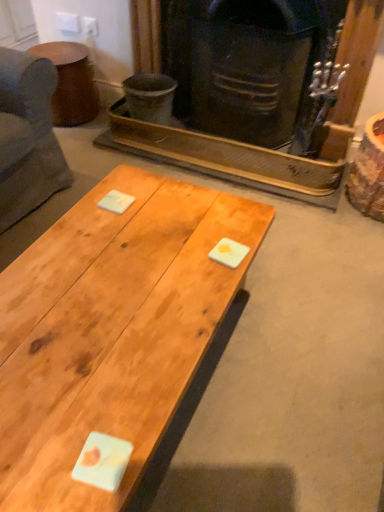
In order to face brown matte side table at upper left, should I rotate leftwards or rightwards?

It's best to rotate left around 17.059 degrees.

Image resolution: width=384 pixels, height=512 pixels. I want to click on brown matte side table at upper left, so pos(71,83).

Consider the image. Does brown matte side table at upper left lie in front of natural wood coffee table at center?

That is False.

Considering the sizes of objects brown matte side table at upper left and natural wood coffee table at center in the image provided, who is taller, brown matte side table at upper left or natural wood coffee table at center?

Standing taller between the two is natural wood coffee table at center.

You are a GUI agent. You are given a task and a screenshot of the screen. Output one action in this format:
    pyautogui.click(x=<x>, y=<y>)
    Task: Click on the coffee table on the right of the brown matte side table at upper left
    Image resolution: width=384 pixels, height=512 pixels.
    Given the screenshot: What is the action you would take?
    pyautogui.click(x=111, y=330)

Considering the sizes of objects brown matte side table at upper left and natural wood coffee table at center in the image provided, who is wider, brown matte side table at upper left or natural wood coffee table at center?

natural wood coffee table at center is wider.

Based on the photo, is brown matte side table at upper left wider than dark brown wood fireplace at center?

Indeed, brown matte side table at upper left has a greater width compared to dark brown wood fireplace at center.

From a real-world perspective, which is physically below, brown matte side table at upper left or dark brown wood fireplace at center?

In real-world perspective, brown matte side table at upper left is lower.

Do you think brown matte side table at upper left is within dark brown wood fireplace at center, or outside of it?

The correct answer is: outside.

Does brown matte side table at upper left turn towards dark brown wood fireplace at center?

No, brown matte side table at upper left is not turned towards dark brown wood fireplace at center.

Would you say dark brown wood fireplace at center is inside or outside brown matte side table at upper left?

The correct answer is: outside.

Is brown matte side table at upper left at the back of dark brown wood fireplace at center?

No, dark brown wood fireplace at center is not facing the opposite direction of brown matte side table at upper left.

Considering the positions of objects dark brown wood fireplace at center and brown matte side table at upper left in the image provided, who is behind, dark brown wood fireplace at center or brown matte side table at upper left?

brown matte side table at upper left.

Which of these two, dark brown wood fireplace at center or brown matte side table at upper left, is wider?

Wider between the two is brown matte side table at upper left.

Can you confirm if natural wood coffee table at center is positioned to the right of dark brown wood fireplace at center?

In fact, natural wood coffee table at center is to the left of dark brown wood fireplace at center.

Which point is more distant from viewer, (130, 263) or (168, 156)?

Positioned behind is point (168, 156).

From a real-world perspective, who is located lower, natural wood coffee table at center or dark brown wood fireplace at center?

In real-world perspective, natural wood coffee table at center is lower.

Who is more distant, natural wood coffee table at center or dark brown wood fireplace at center?

dark brown wood fireplace at center is more distant.

From a real-world perspective, is dark brown wood fireplace at center physically located above or below natural wood coffee table at center?

In terms of real-world spatial position, dark brown wood fireplace at center is above natural wood coffee table at center.

Is there a large distance between dark brown wood fireplace at center and natural wood coffee table at center?

Yes.

From the picture: Is natural wood coffee table at center at the back of dark brown wood fireplace at center?

No, dark brown wood fireplace at center's orientation is not away from natural wood coffee table at center.

From the image's perspective, is dark brown wood fireplace at center above natural wood coffee table at center?

Indeed, from the image's perspective, dark brown wood fireplace at center is shown above natural wood coffee table at center.

Which object is more forward, natural wood coffee table at center or brown matte side table at upper left?

natural wood coffee table at center is more forward.

Is natural wood coffee table at center in contact with brown matte side table at upper left?

No, natural wood coffee table at center is not beside brown matte side table at upper left.

Identify the location of coffee table that appears on the right of brown matte side table at upper left. (111, 330).

Locate an element on the screen. The height and width of the screenshot is (512, 384). side table beneath the natural wood coffee table at center (from a real-world perspective) is located at coordinates (71, 83).

Find the location of a particular element. Image resolution: width=384 pixels, height=512 pixels. side table located on the left of dark brown wood fireplace at center is located at coordinates (71, 83).

When comparing their distances from natural wood coffee table at center, does brown matte side table at upper left or dark brown wood fireplace at center seem further?

brown matte side table at upper left is positioned further to the anchor natural wood coffee table at center.

From the image, which object appears to be nearer to dark brown wood fireplace at center, brown matte side table at upper left or natural wood coffee table at center?

brown matte side table at upper left is closer to dark brown wood fireplace at center.

Which object lies further to the anchor point brown matte side table at upper left, natural wood coffee table at center or dark brown wood fireplace at center?

Among the two, natural wood coffee table at center is located further to brown matte side table at upper left.

Considering their positions, is dark brown wood fireplace at center positioned closer to brown matte side table at upper left than natural wood coffee table at center?

dark brown wood fireplace at center lies closer to brown matte side table at upper left than the other object.

Based on their spatial positions, is dark brown wood fireplace at center or brown matte side table at upper left further from natural wood coffee table at center?

Among the two, brown matte side table at upper left is located further to natural wood coffee table at center.

When comparing their distances from dark brown wood fireplace at center, does natural wood coffee table at center or brown matte side table at upper left seem further?

Among the two, natural wood coffee table at center is located further to dark brown wood fireplace at center.

Locate an element on the screen. fireplace located between natural wood coffee table at center and brown matte side table at upper left in the depth direction is located at coordinates (232, 156).